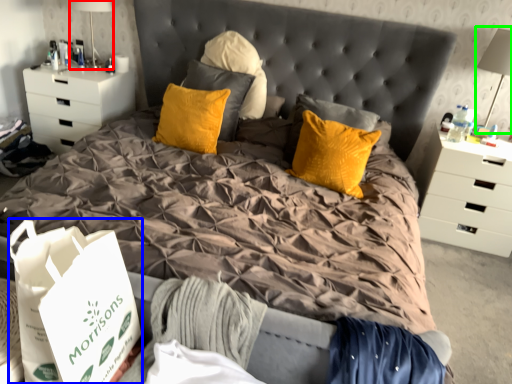
Question: Which object is positioned closest to table lamp (highlighted by a red box)? Select from shopping bag (highlighted by a blue box) and table lamp (highlighted by a green box).

Choices:
 (A) shopping bag
 (B) table lamp

Answer: (A)